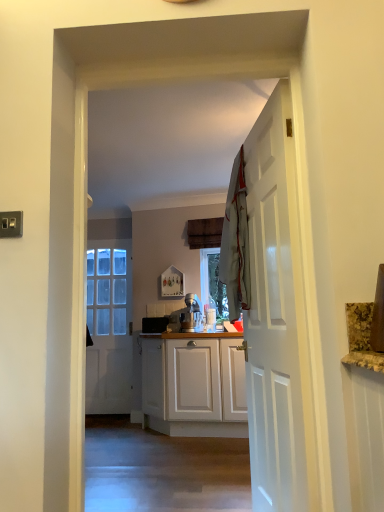
Question: Considering the relative sizes of light gray fabric at center and white glossy door at center, the second door positioned from the right, in the image provided, is light gray fabric at center wider than white glossy door at center, the second door positioned from the right,?

Choices:
 (A) yes
 (B) no

Answer: (A)

Question: Considering the relative sizes of light gray fabric at center and white glossy door at center, the second door positioned from the right, in the image provided, is light gray fabric at center bigger than white glossy door at center, the second door positioned from the right,?

Choices:
 (A) no
 (B) yes

Answer: (A)

Question: Considering the relative sizes of light gray fabric at center and white glossy door at center, arranged as the 2th door when viewed from the front, in the image provided, is light gray fabric at center taller than white glossy door at center, arranged as the 2th door when viewed from the front,?

Choices:
 (A) yes
 (B) no

Answer: (B)

Question: From the image's perspective, does light gray fabric at center appear higher than white glossy door at center, the first door when ordered from left to right?

Choices:
 (A) no
 (B) yes

Answer: (B)

Question: Is light gray fabric at center oriented away from white glossy door at center, the second door positioned from the right?

Choices:
 (A) yes
 (B) no

Answer: (B)

Question: Based on their positions, is white glossy door at center, the first door when ordered from back to front, located to the left or right of white wooden door at right, the 2th door positioned from the back?

Choices:
 (A) right
 (B) left

Answer: (B)

Question: From the image's perspective, is white glossy door at center, arranged as the 2th door when viewed from the front, located above or below white wooden door at right, the second door when ordered from left to right?

Choices:
 (A) below
 (B) above

Answer: (A)

Question: Is point (120, 311) closer or farther from the camera than point (261, 147)?

Choices:
 (A) farther
 (B) closer

Answer: (A)

Question: From their relative heights in the image, would you say white glossy door at center, arranged as the 2th door when viewed from the front, is taller or shorter than white wooden door at right, the 2th door positioned from the back?

Choices:
 (A) tall
 (B) short

Answer: (A)

Question: Is point [x=89, y=391] positioned closer to the camera than point [x=243, y=217]?

Choices:
 (A) closer
 (B) farther

Answer: (B)

Question: Based on their positions, is white glossy door at center, the second door positioned from the right, located to the left or right of light gray fabric at center?

Choices:
 (A) right
 (B) left

Answer: (B)

Question: Is white glossy door at center, the first door when ordered from left to right, in front of or behind light gray fabric at center in the image?

Choices:
 (A) behind
 (B) front

Answer: (A)

Question: From a real-world perspective, relative to light gray fabric at center, is white glossy door at center, the first door when ordered from left to right, vertically above or below?

Choices:
 (A) below
 (B) above

Answer: (A)

Question: Looking at their shapes, would you say white wooden door at right, acting as the first door starting from the right, is wider or thinner than light gray fabric at center?

Choices:
 (A) thin
 (B) wide

Answer: (A)

Question: Relative to light gray fabric at center, is white wooden door at right, acting as the first door starting from the right, in front or behind?

Choices:
 (A) front
 (B) behind

Answer: (A)